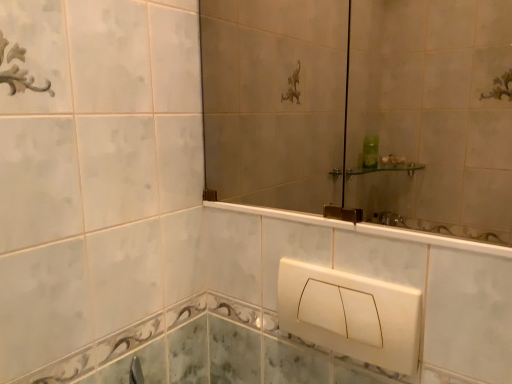
Question: From the image's perspective, relative to matte glass mirror at upper center, is white plastic toilet cover at lower center above or below?

Choices:
 (A) below
 (B) above

Answer: (A)

Question: Considering the relative positions of white plastic toilet cover at lower center and matte glass mirror at upper center in the image provided, is white plastic toilet cover at lower center to the left or to the right of matte glass mirror at upper center?

Choices:
 (A) left
 (B) right

Answer: (B)

Question: Would you say white plastic toilet cover at lower center is inside or outside matte glass mirror at upper center?

Choices:
 (A) outside
 (B) inside

Answer: (A)

Question: Is point (212, 190) positioned closer to the camera than point (389, 322)?

Choices:
 (A) farther
 (B) closer

Answer: (A)

Question: Is matte glass mirror at upper center inside or outside of white plastic toilet cover at lower center?

Choices:
 (A) outside
 (B) inside

Answer: (A)

Question: Considering their positions, is matte glass mirror at upper center located in front of or behind white plastic toilet cover at lower center?

Choices:
 (A) behind
 (B) front

Answer: (B)

Question: From the image's perspective, is matte glass mirror at upper center positioned above or below white plastic toilet cover at lower center?

Choices:
 (A) above
 (B) below

Answer: (A)